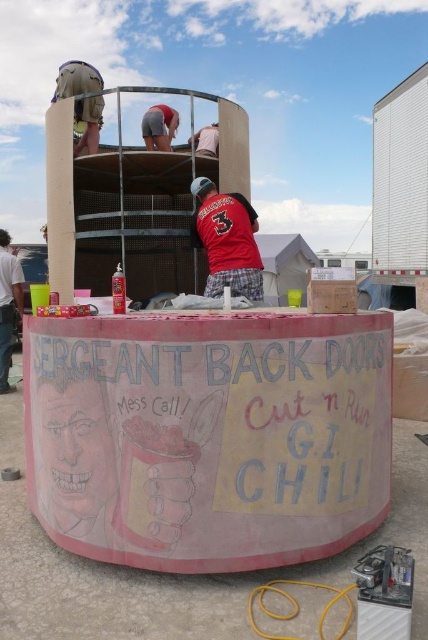
Which is more to the left, pink chalkboard sign at center or brushed metal helmet at upper left?

Positioned to the left is brushed metal helmet at upper left.

Which is in front, point (293, 500) or point (80, 140)?

Positioned in front is point (293, 500).

This screenshot has height=640, width=428. Find the location of `pink chalkboard sign at center`. pink chalkboard sign at center is located at coordinates pos(208,436).

Who is more distant from viewer, (255, 486) or (258, 282)?

The point (258, 282) is behind.

Does pink chalkboard sign at center lie behind matte red shirt at center?

No, pink chalkboard sign at center is closer to the viewer.

Which is behind, point (71, 436) or point (244, 280)?

The point (244, 280) is more distant.

The width and height of the screenshot is (428, 640). I want to click on pink chalkboard sign at center, so click(x=208, y=436).

Can you confirm if matte red shirt at center is positioned to the right of brushed metal helmet at upper left?

Yes, matte red shirt at center is to the right of brushed metal helmet at upper left.

Does point (235, 250) come closer to viewer compared to point (95, 106)?

Yes, it is in front of point (95, 106).

Where is `matte red shirt at center`? The image size is (428, 640). matte red shirt at center is located at coordinates (226, 241).